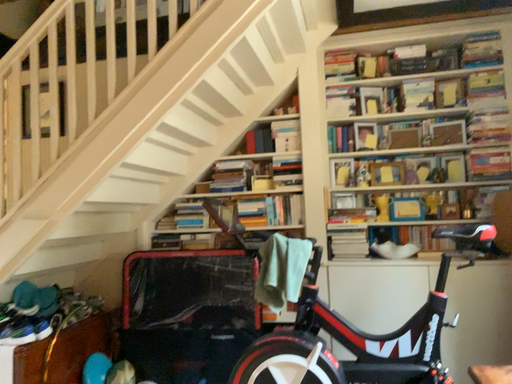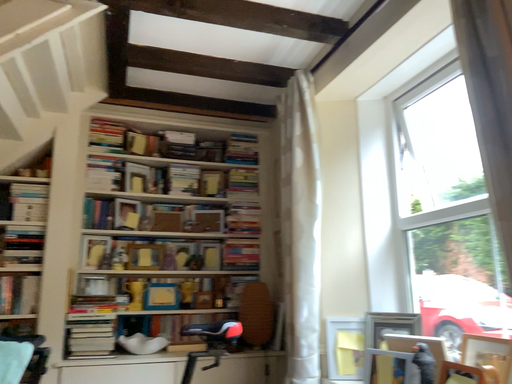
Question: Which way did the camera rotate in the video?

Choices:
 (A) rotated upward
 (B) rotated downward

Answer: (A)